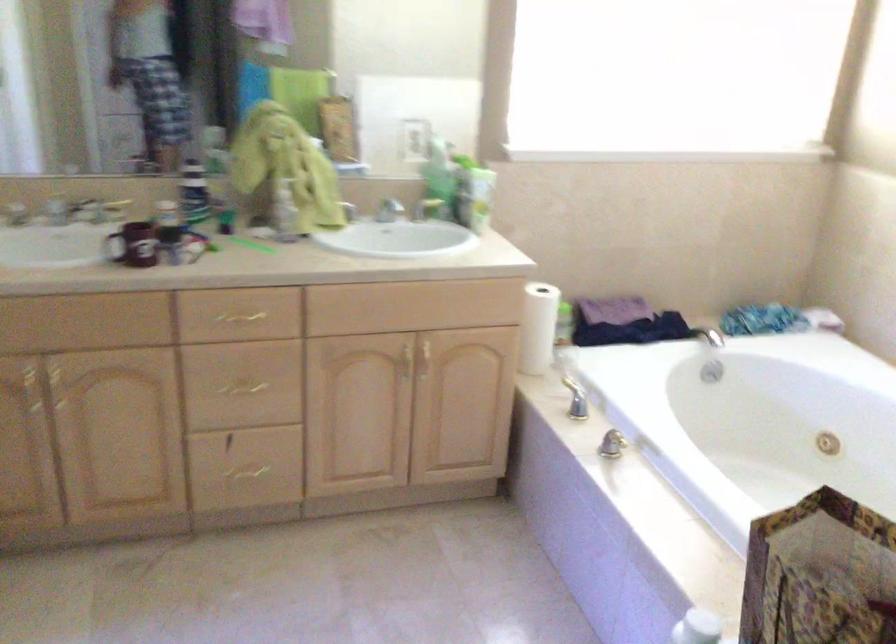
The location [479,198] corresponds to which object?

This point indicates the green bottle.